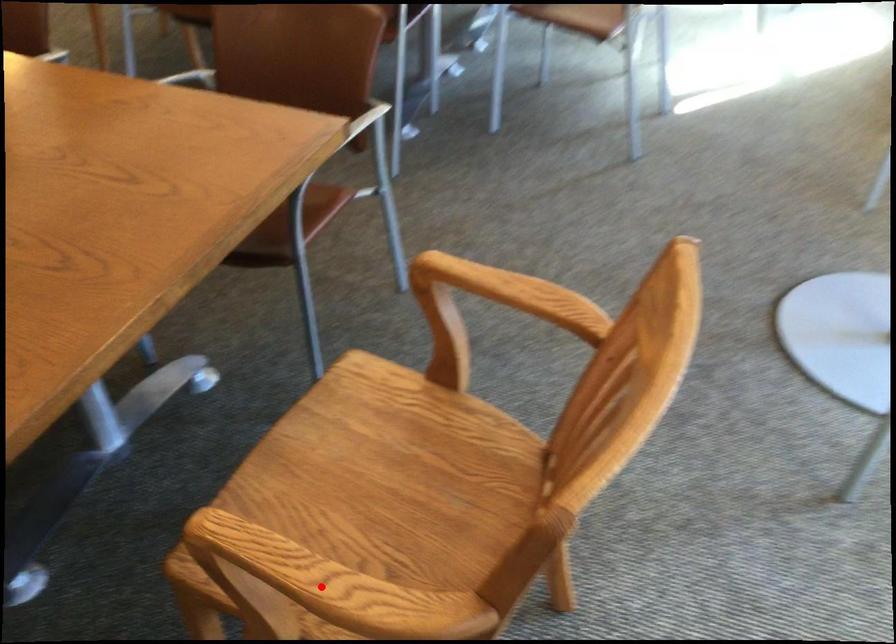
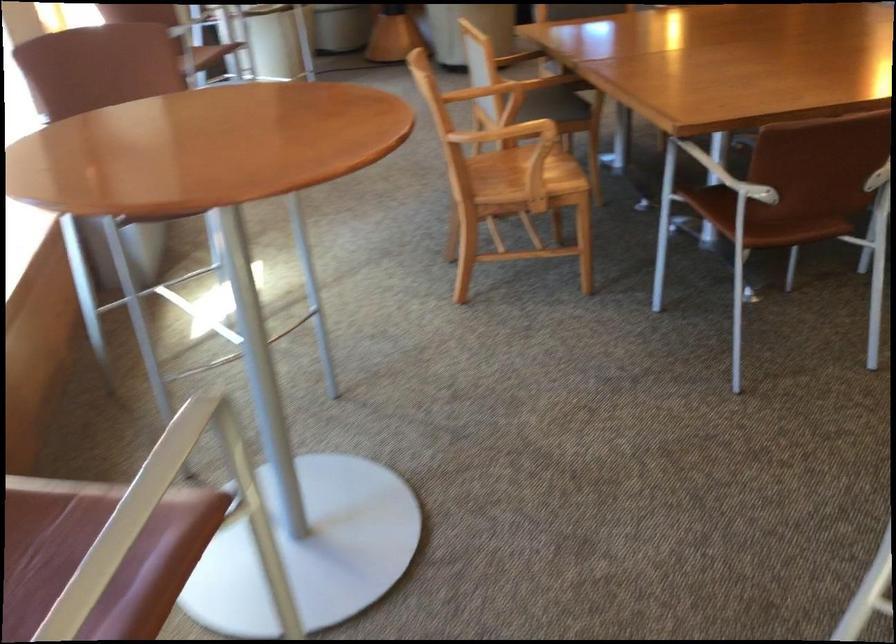
Question: I am providing you with two images of the same scene from different viewpoints. A red point is marked on the first image. Can you still see the location of the red point in image 2?

Choices:
 (A) Yes
 (B) No

Answer: (B)